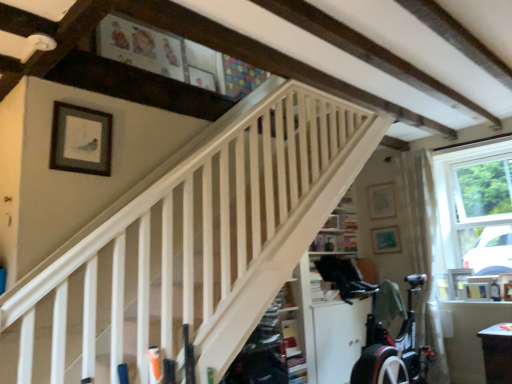
Question: Is white wooden stairs at center in front of matte black picture frame at lower right, the 2th picture frame viewed from the right?

Choices:
 (A) yes
 (B) no

Answer: (A)

Question: Is the depth of white wooden stairs at center greater than that of matte black picture frame at lower right, the fifth picture frame in the left-to-right sequence?

Choices:
 (A) no
 (B) yes

Answer: (A)

Question: From the image's perspective, is white wooden stairs at center beneath matte black picture frame at lower right, placed as the 4th picture frame when sorted from back to front?

Choices:
 (A) yes
 (B) no

Answer: (B)

Question: Are white wooden stairs at center and matte black picture frame at lower right, arranged as the first picture frame when ordered from the bottom, making contact?

Choices:
 (A) no
 (B) yes

Answer: (A)

Question: Is white wooden stairs at center at the left side of matte black picture frame at lower right, marked as the third picture frame in a front-to-back arrangement?

Choices:
 (A) no
 (B) yes

Answer: (B)

Question: Is white wooden stairs at center shorter than matte black picture frame at lower right, arranged as the first picture frame when ordered from the bottom?

Choices:
 (A) no
 (B) yes

Answer: (A)

Question: Is wooden picture frame at right, which is the first picture frame from right to left, located outside white wooden stairs at center?

Choices:
 (A) yes
 (B) no

Answer: (A)

Question: From the image's perspective, is wooden picture frame at right, the 5th picture frame positioned from the back, on white wooden stairs at center?

Choices:
 (A) yes
 (B) no

Answer: (B)

Question: Does wooden picture frame at right, the 5th picture frame positioned from the back, have a lesser height compared to white wooden stairs at center?

Choices:
 (A) no
 (B) yes

Answer: (B)

Question: Could you tell me if wooden picture frame at right, which is the second picture frame from front to back, is facing white wooden stairs at center?

Choices:
 (A) no
 (B) yes

Answer: (B)

Question: Can you confirm if wooden picture frame at right, which appears as the third picture frame when ordered from the bottom, is positioned to the left of white wooden stairs at center?

Choices:
 (A) yes
 (B) no

Answer: (B)

Question: From a real-world perspective, is wooden picture frame at right, which is the first picture frame from right to left, over white wooden stairs at center?

Choices:
 (A) yes
 (B) no

Answer: (B)

Question: From a real-world perspective, is white wooden stairs at center located beneath wooden picture frame at right, the second picture frame when ordered from bottom to top?

Choices:
 (A) yes
 (B) no

Answer: (B)